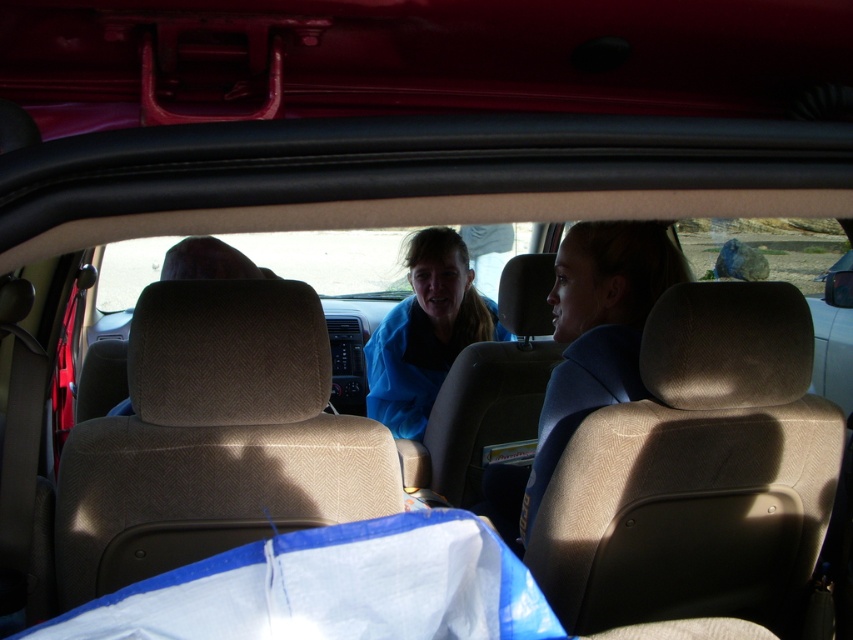
You are a passenger in the back seat of the car and need to place a small item on the blue fabric headrest at right and the blue fabric jacket at center. Which surface can accommodate the item better based on their sizes?

The blue fabric headrest at right is larger in size than the blue fabric jacket at center, so it can accommodate the item better.

You are a person who is 1.60 meters tall and want to reach the blue fabric headrest at right in the car. Can you comfortably touch it while standing inside the car?

The blue fabric headrest at right and the viewer are 1.60 meters apart. Since you are 1.60 meters tall, you might be able to reach it if you stretch your arm fully, but it may require some effort depending on your arm length.

You are sitting in the back seat of a car and notice two blue items. One is the blue fabric headrest at right and the other is the blue fabric jacket at center. Which one is positioned more to the right side of the car?

The blue fabric headrest at right is positioned more to the right side of the car than the blue fabric jacket at center.